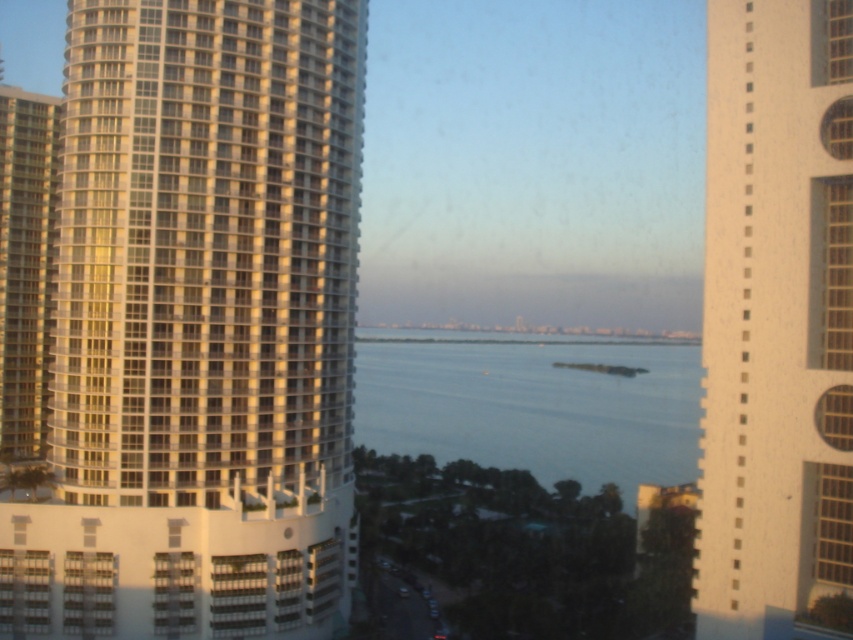
You are an architect evaluating the spatial layout of this waterfront view. Considering the white glass building at left and the blue water at center, which object occupies a larger portion of the visual field from this vantage point?

The blue water at center occupies a larger portion of the visual field than the white glass building at left, as it is described as being larger in the scene.

You are standing on a balcony and want to take a photo of both the blue water at center and the matte glass windows at left. Which object will appear closer to the camera in your photo?

The blue water at center will appear closer to the camera in the photo because it is further to the viewer than the matte glass windows at left, meaning it is positioned nearer to the observer.

You are standing at the point where the image was taken and want to know how far you are from the point marked at coordinates (x=474, y=428). Can you determine the distance?

The point marked at coordinates (x=474, y=428) is 175.85 meters away from your current position.